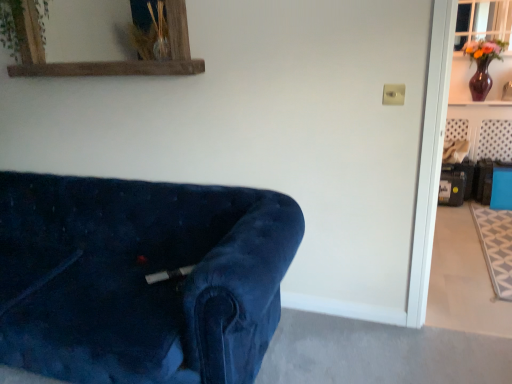
Question: Is matte purple vase at upper right completely or partially outside of rustic wood mirror at upper left?

Choices:
 (A) no
 (B) yes

Answer: (B)

Question: Is matte purple vase at upper right with rustic wood mirror at upper left?

Choices:
 (A) yes
 (B) no

Answer: (B)

Question: From a real-world perspective, is matte purple vase at upper right under rustic wood mirror at upper left?

Choices:
 (A) no
 (B) yes

Answer: (B)

Question: Is the position of matte purple vase at upper right less distant than that of rustic wood mirror at upper left?

Choices:
 (A) no
 (B) yes

Answer: (A)

Question: Does matte purple vase at upper right turn towards rustic wood mirror at upper left?

Choices:
 (A) yes
 (B) no

Answer: (B)

Question: From the image's perspective, is matte purple vase at upper right under rustic wood mirror at upper left?

Choices:
 (A) yes
 (B) no

Answer: (B)

Question: Considering the relative sizes of velvet blue couch at lower left and clear glass window at upper right in the image provided, is velvet blue couch at lower left thinner than clear glass window at upper right?

Choices:
 (A) no
 (B) yes

Answer: (A)

Question: Is velvet blue couch at lower left positioned behind clear glass window at upper right?

Choices:
 (A) yes
 (B) no

Answer: (B)

Question: Considering the relative sizes of velvet blue couch at lower left and clear glass window at upper right in the image provided, is velvet blue couch at lower left bigger than clear glass window at upper right?

Choices:
 (A) no
 (B) yes

Answer: (B)

Question: Is velvet blue couch at lower left with clear glass window at upper right?

Choices:
 (A) no
 (B) yes

Answer: (A)

Question: Considering the relative sizes of velvet blue couch at lower left and clear glass window at upper right in the image provided, is velvet blue couch at lower left shorter than clear glass window at upper right?

Choices:
 (A) no
 (B) yes

Answer: (A)

Question: Does velvet blue couch at lower left contain clear glass window at upper right?

Choices:
 (A) no
 (B) yes

Answer: (A)

Question: Is green leafy plant at upper left completely or partially outside of rustic wood mirror at upper left?

Choices:
 (A) yes
 (B) no

Answer: (B)